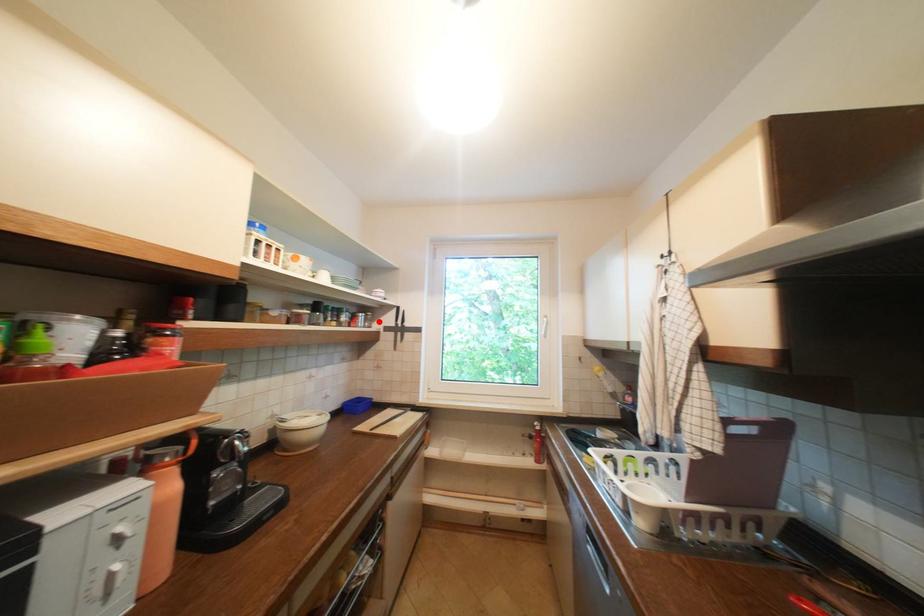
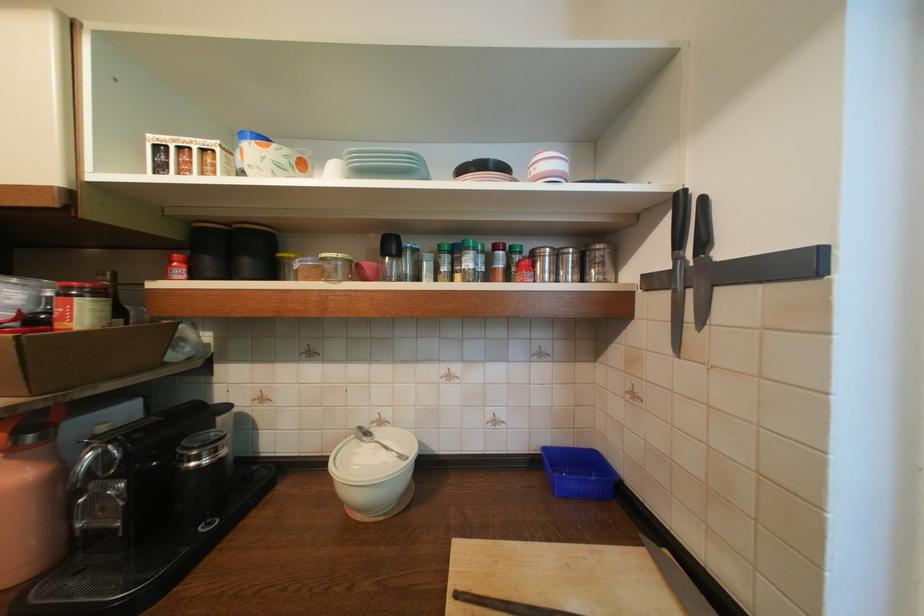
Question: I am providing you with two images of the same scene from different viewpoints. A red point is marked on the first image. Can you still see the location of the red point in image 2?

Choices:
 (A) Yes
 (B) No

Answer: (A)